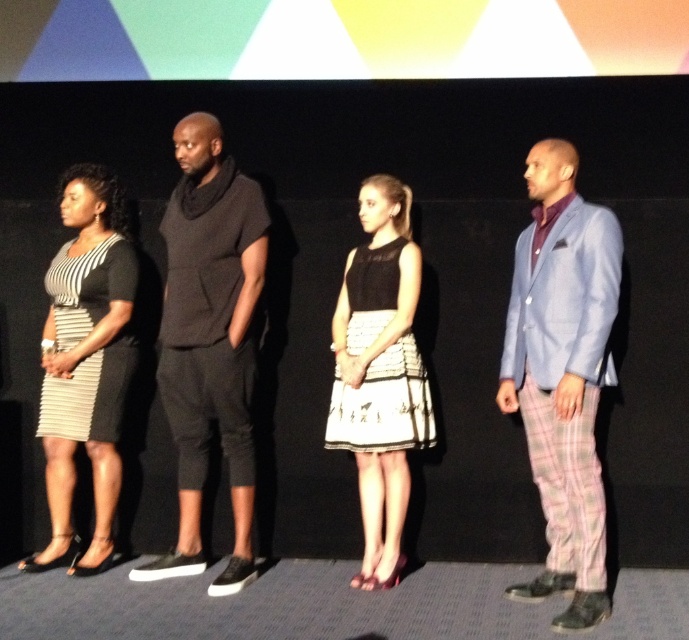
Question: Among these points, which one is farthest from the camera?

Choices:
 (A) (564, 406)
 (B) (203, 364)

Answer: (B)

Question: Which point is closer to the camera?

Choices:
 (A) (114, 403)
 (B) (195, 515)
 (C) (566, 150)

Answer: (C)

Question: Does light blue fabric suit at right lie in front of black satin dress at center?

Choices:
 (A) no
 (B) yes

Answer: (B)

Question: Which object is closer to the camera taking this photo?

Choices:
 (A) black satin dress at center
 (B) light blue fabric suit at right
 (C) striped fabric dress at left

Answer: (B)

Question: From the image, what is the correct spatial relationship of light blue fabric suit at right in relation to black satin dress at center?

Choices:
 (A) above
 (B) below

Answer: (A)

Question: Does striped fabric dress at left have a smaller size compared to black satin dress at center?

Choices:
 (A) yes
 (B) no

Answer: (B)